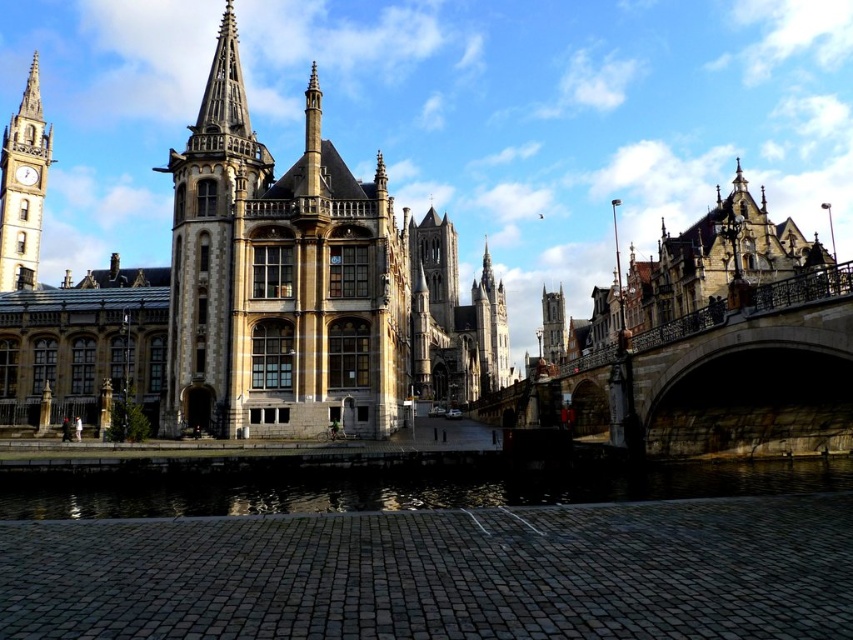
You are standing on the dark stone bridge at right and want to take a photo of the smooth stone clock tower at left. Which direction should you face to capture the entire clock tower in your view?

You should face upward because the dark stone bridge at right is below the smooth stone clock tower at left, so looking upward will allow you to capture the entire clock tower in your view.

In the scene shown: You are a tourist standing on the dark stone bridge at right and want to take a photo of the stone steeple at center. Considering their sizes, which object should you move closer to in order to capture the entire steeple in your camera frame?

The dark stone bridge at right is larger in size than the stone steeple at center. To capture the entire steeple in your camera frame, you should move closer to the stone steeple at center since it is smaller and requires a wider angle or closer proximity to fit within the frame.